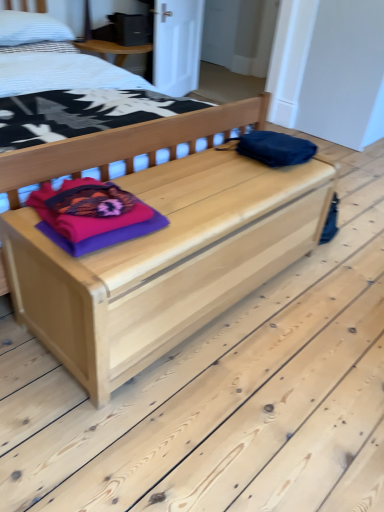
Question: From the image's perspective, is purple fabric at center located above or below natural wood bed at center?

Choices:
 (A) below
 (B) above

Answer: (A)

Question: In terms of size, does purple fabric at center appear bigger or smaller than natural wood bed at center?

Choices:
 (A) small
 (B) big

Answer: (A)

Question: Considering the real-world distances, which object is farthest from the natural wood bed at center?

Choices:
 (A) natural wood chest at center
 (B) white textured pillow at upper left
 (C) purple fabric at center

Answer: (C)

Question: Which of these objects is positioned farthest from the purple fabric at center?

Choices:
 (A) natural wood chest at center
 (B) natural wood bed at center
 (C) white textured pillow at upper left

Answer: (C)